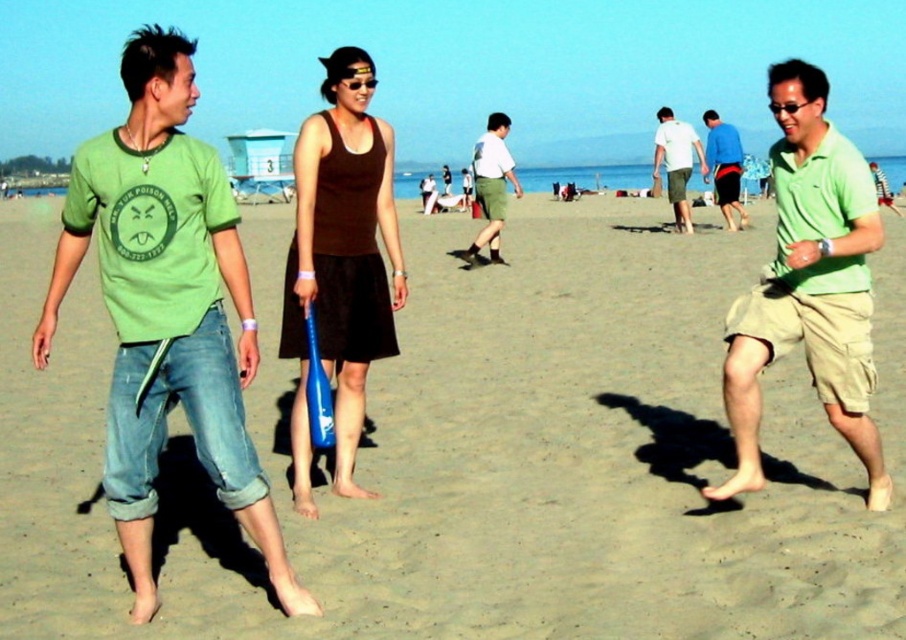
Who is positioned more to the right, green matte t-shirt at left or green matte shirt at center?

green matte shirt at center

Is point (114, 260) closer to viewer compared to point (733, 368)?

That is True.

I want to click on green matte t-shirt at left, so click(x=167, y=308).

Is smooth tan sand at center smaller than matte brown tank top at center?

Actually, smooth tan sand at center might be larger than matte brown tank top at center.

Does point (784, 509) come farther from viewer compared to point (342, 52)?

That is False.

Identify the location of smooth tan sand at center. Image resolution: width=906 pixels, height=640 pixels. point(478,454).

Between point (781, 284) and point (737, 156), which one is positioned in front?

Point (781, 284)

Does green matte shirt at center have a smaller size compared to blue fabric shorts at center?

Indeed, green matte shirt at center has a smaller size compared to blue fabric shorts at center.

Which is in front, point (743, 371) or point (717, 132)?

Positioned in front is point (743, 371).

The image size is (906, 640). Find the location of `green matte shirt at center`. green matte shirt at center is located at coordinates (808, 284).